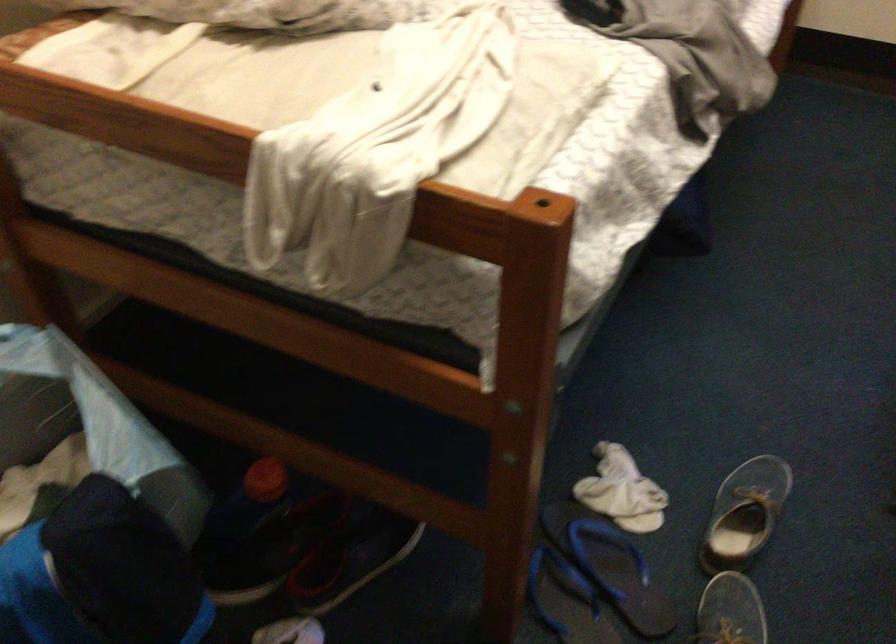
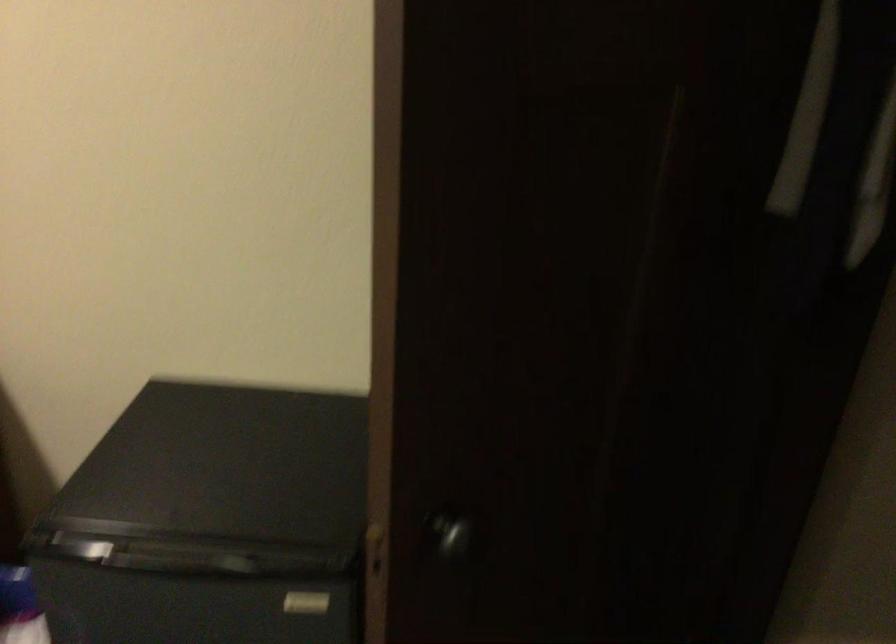
The first image is from the beginning of the video and the second image is from the end. How did the camera likely rotate when shooting the video?

The camera rotated toward right-down.